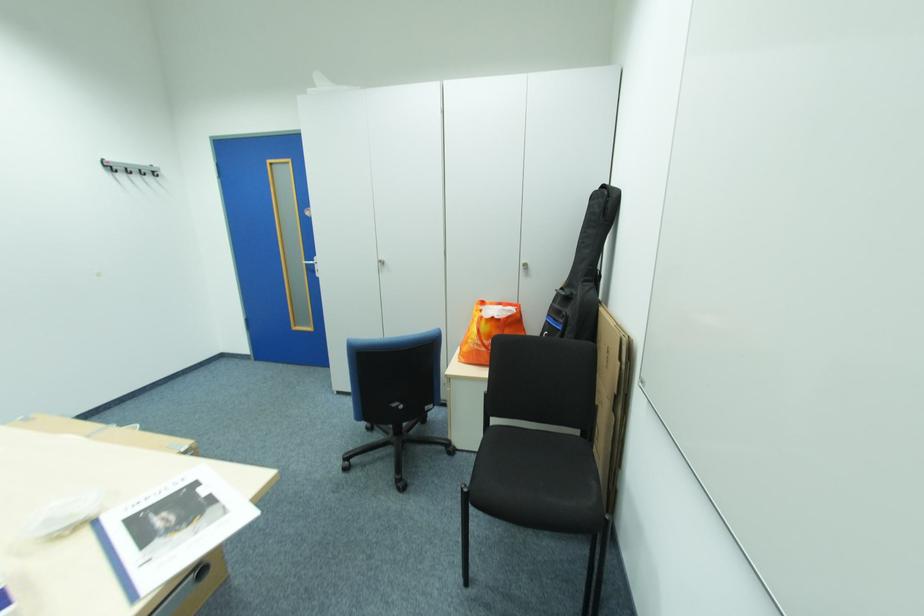
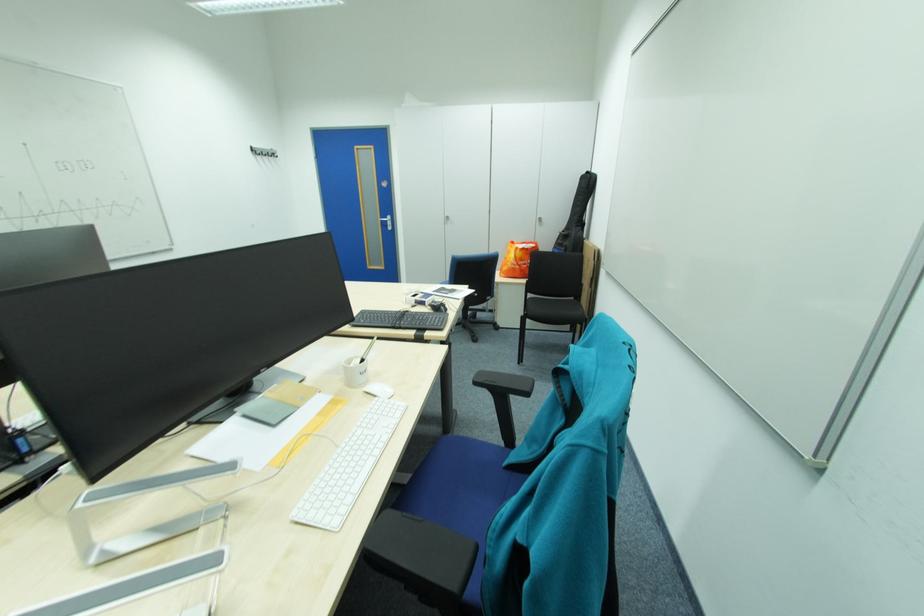
Where in the second image is the point corresponding to point (114, 171) from the first image?

(262, 153)